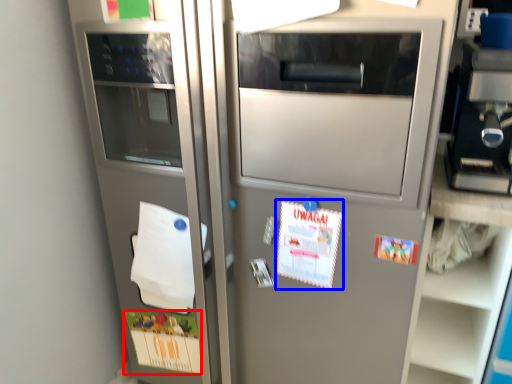
Question: Which point is closer to the camera, postcard (highlighted by a red box) or postcard (highlighted by a blue box)?

Choices:
 (A) postcard
 (B) postcard

Answer: (B)